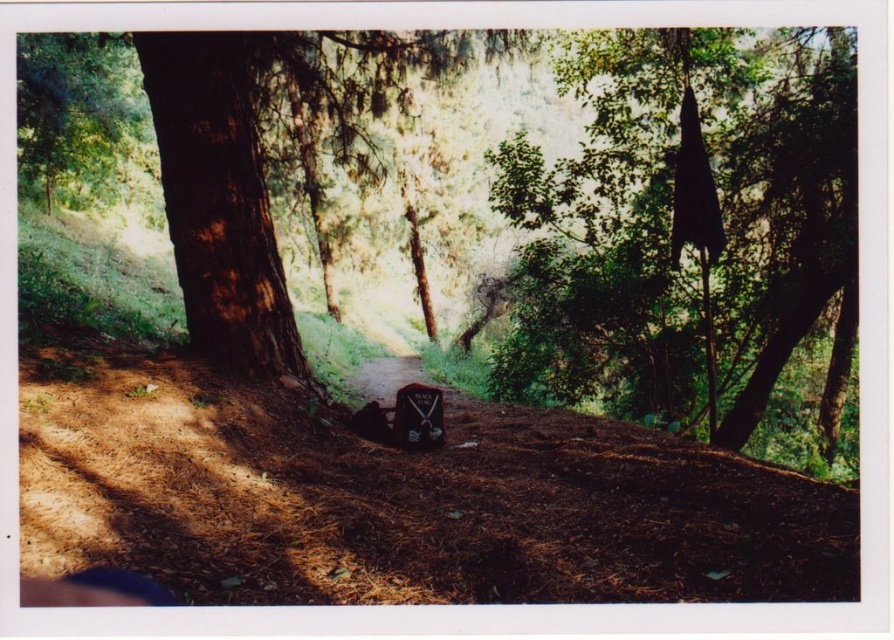
Can you confirm if black matte gravestone at center is bigger than smooth wooden sign at center?

Incorrect, black matte gravestone at center is not larger than smooth wooden sign at center.

Find the location of a particular element. This screenshot has height=640, width=894. black matte gravestone at center is located at coordinates (403, 419).

You are a GUI agent. You are given a task and a screenshot of the screen. Output one action in this format:
    pyautogui.click(x=<x>, y=<y>)
    Task: Click on the black matte gravestone at center
    This screenshot has height=640, width=894.
    Given the screenshot: What is the action you would take?
    pyautogui.click(x=403, y=419)

How much distance is there between black matte umbrella at upper right and black matte gravestone at center?

A distance of 4.97 meters exists between black matte umbrella at upper right and black matte gravestone at center.

The image size is (894, 640). Find the location of `black matte umbrella at upper right`. black matte umbrella at upper right is located at coordinates (682, 224).

Where is `black matte umbrella at upper right`? The height and width of the screenshot is (640, 894). black matte umbrella at upper right is located at coordinates (682, 224).

Is brown dirt track at lower center taller than black matte gravestone at center?

Indeed, brown dirt track at lower center has a greater height compared to black matte gravestone at center.

This screenshot has width=894, height=640. In order to click on brown dirt track at lower center in this screenshot , I will do `click(405, 500)`.